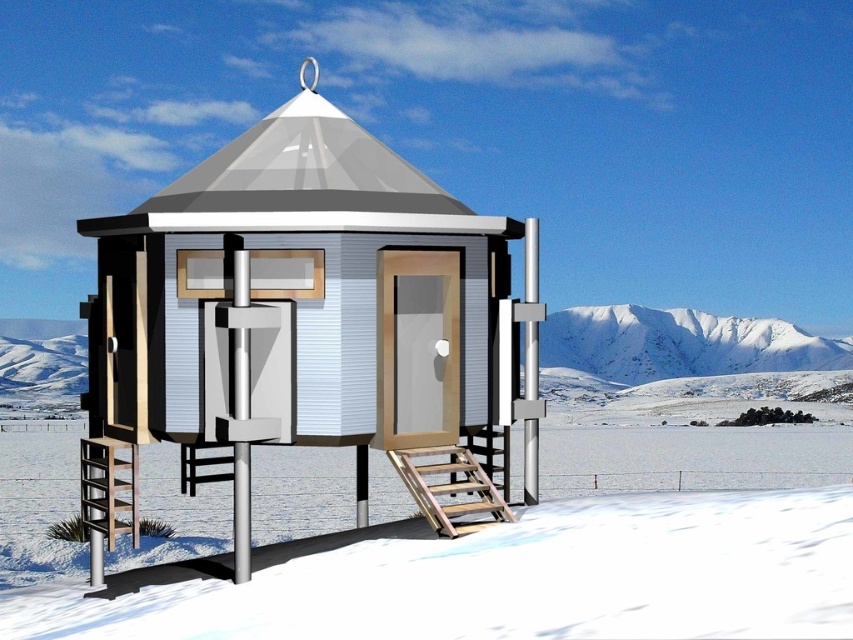
Where is `white snow-covered mountain at upper right`? Image resolution: width=853 pixels, height=640 pixels. white snow-covered mountain at upper right is located at coordinates (680, 342).

Who is shorter, white snow-covered mountain at upper right or wooden at lower right?

wooden at lower right is shorter.

At what (x,y) coordinates should I click in order to perform the action: click on white snow-covered mountain at upper right. Please return your answer as a coordinate pair (x, y). Looking at the image, I should click on (680, 342).

Which of these two, white powdery snow at lower center or white snow-covered mountain at left, stands taller?

With more height is white snow-covered mountain at left.

Describe the element at coordinates (517, 579) in the screenshot. I see `white powdery snow at lower center` at that location.

Does point (24, 611) come behind point (3, 340)?

No, (24, 611) is closer to viewer.

This screenshot has width=853, height=640. Identify the location of white powdery snow at lower center. (517, 579).

From the picture: Between wooden at lower right and white snow-covered mountain at left, which one has less height?

Standing shorter between the two is wooden at lower right.

Is wooden at lower right positioned before white snow-covered mountain at left?

Yes, wooden at lower right is in front of white snow-covered mountain at left.

Locate an element on the screen. This screenshot has width=853, height=640. wooden at lower right is located at coordinates (448, 484).